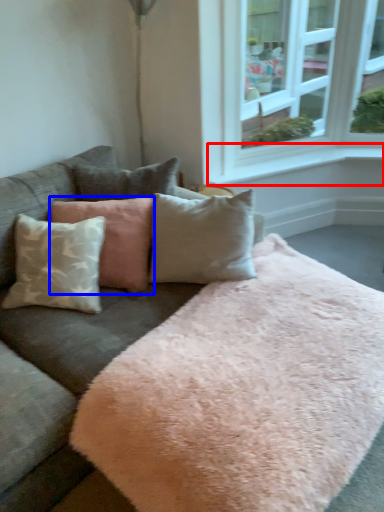
Question: Which object appears farthest to the camera in this image, window sill (highlighted by a red box) or pillow (highlighted by a blue box)?

Choices:
 (A) window sill
 (B) pillow

Answer: (A)